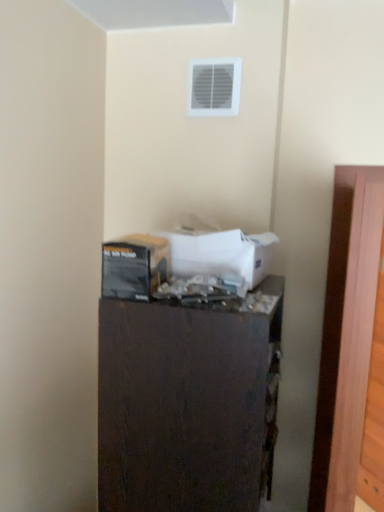
Question: Looking at their shapes, would you say white cardboard box at center, which is counted as the first box, starting from the right, is wider or thinner than matte black box at center, which is the second box from right to left?

Choices:
 (A) thin
 (B) wide

Answer: (B)

Question: Considering the relative positions of white cardboard box at center, which is counted as the first box, starting from the right, and matte black box at center, which is the second box from right to left, in the image provided, is white cardboard box at center, which is counted as the first box, starting from the right, to the left or to the right of matte black box at center, which is the second box from right to left,?

Choices:
 (A) right
 (B) left

Answer: (A)

Question: Considering the real-world distances, which object is farthest from the dark wood dresser at center?

Choices:
 (A) wooden at right
 (B) white plastic vent at upper center
 (C) white cardboard box at center, the second box from the left
 (D) matte black box at center, which is the second box from right to left

Answer: (B)

Question: Based on their relative distances, which object is farther from the white plastic vent at upper center?

Choices:
 (A) dark wood dresser at center
 (B) white cardboard box at center, the second box from the left
 (C) wooden at right
 (D) matte black box at center, which is the second box from right to left

Answer: (A)